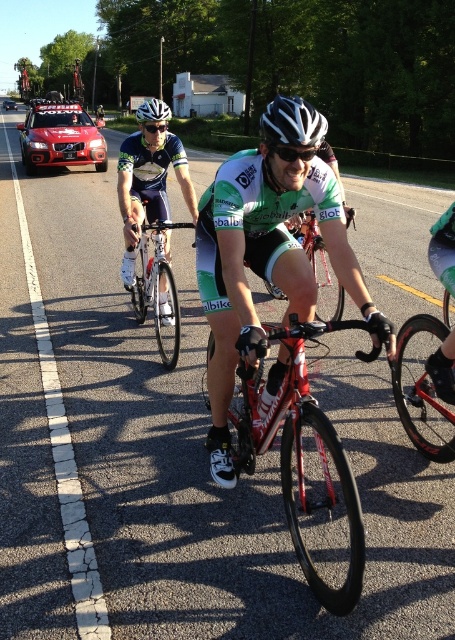
You are a cyclist in the race and you need to pass the metallic red car at left. Can you safely pass the car using the road space available? Explain your reasoning based on the position of the matte black bicycle at left.

The matte black bicycle at left is in front of the metallic red car at left, meaning the cyclist can safely pass the car by moving around the bicycle in the available road space since the car is behind the bicycle.

You are a photographer positioned at the starting line of the cycling event. You want to capture a photo that includes both the matte black bicycle at left and the metallic red car at left. Since you have a limited field of view, which object should you adjust your camera to focus on first to ensure both are in frame?

The matte black bicycle at left is thinner than the metallic red car at left, so you should focus on the metallic red car at left first as it is wider and requires more space in the frame.

You are a photographer positioned at the starting line of the cycling event. You want to capture a photo where both the green matte cycling jersey at center and the shiny silver bicycle at center are clearly visible. Which object should you focus on to ensure both are in frame without moving the camera?

The green matte cycling jersey at center might be wider than the shiny silver bicycle at center, so focusing on the jersey ensures both are in frame as it occupies more space.